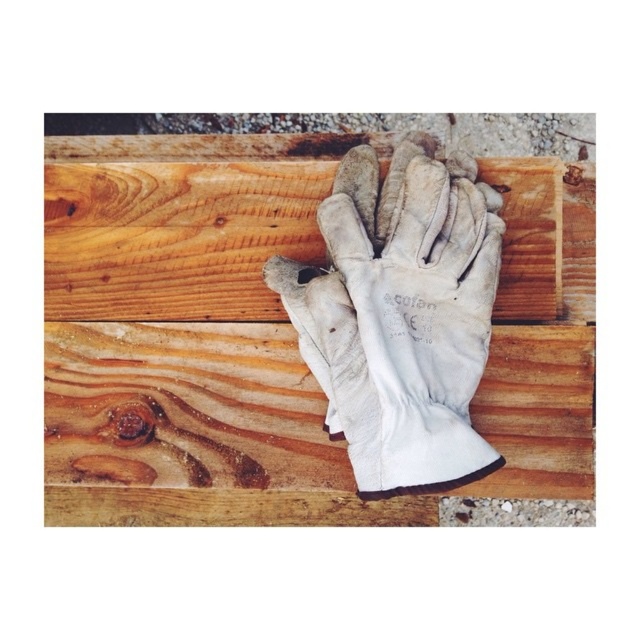
Question: Considering the real-world distances, which object is closest to the white leather glove at center?

Choices:
 (A) wooden plank at center
 (B) natural wood at center

Answer: (A)

Question: Does natural wood at center lie behind white leather glove at center?

Choices:
 (A) yes
 (B) no

Answer: (A)

Question: Which object appears farthest from the camera in this image?

Choices:
 (A) wooden plank at center
 (B) natural wood at center
 (C) white leather glove at center

Answer: (B)

Question: Which is farther from the wooden plank at center?

Choices:
 (A) white leather glove at center
 (B) natural wood at center

Answer: (A)

Question: Can you confirm if natural wood at center is positioned to the right of white leather glove at center?

Choices:
 (A) yes
 (B) no

Answer: (B)

Question: Is natural wood at center above wooden plank at center?

Choices:
 (A) no
 (B) yes

Answer: (A)